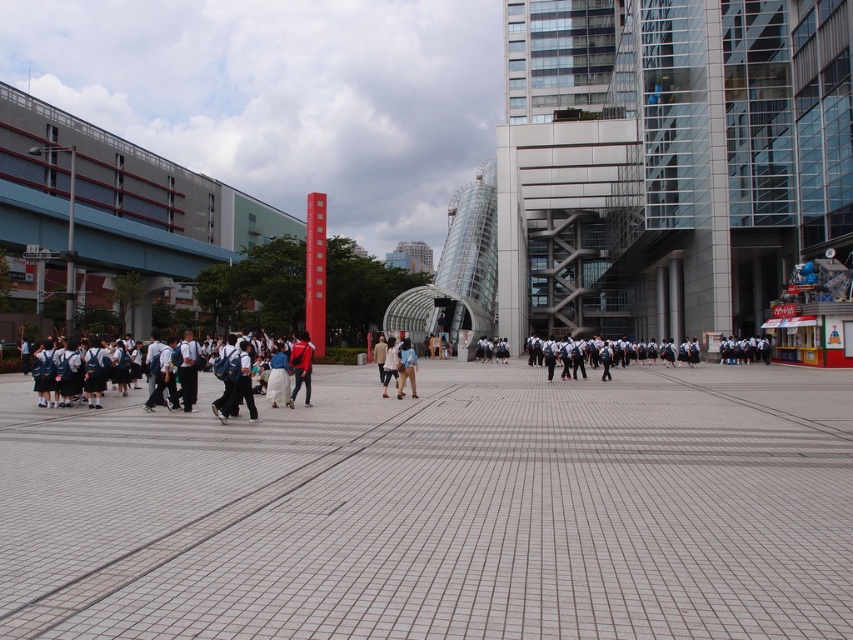
You are a tailor observing the urban scene. You need to determine which clothing item, the white cotton shirt at center or the light brown leather jacket at center, requires more fabric to make. Based on the scene description, which one would you choose?

The light brown leather jacket at center requires more fabric because its width is greater than the white cotton shirt at center.

You are a pedestrian standing at the edge of the plaza. You want to walk to the entrance of a nearby building located behind the white uniform at left. Which direction should you go to avoid stepping on the gray tile pavement at center?

To reach the entrance behind the white uniform at left without stepping on the gray tile pavement at center, you should walk around the white uniform at left since the gray tile pavement at center is in front of it.